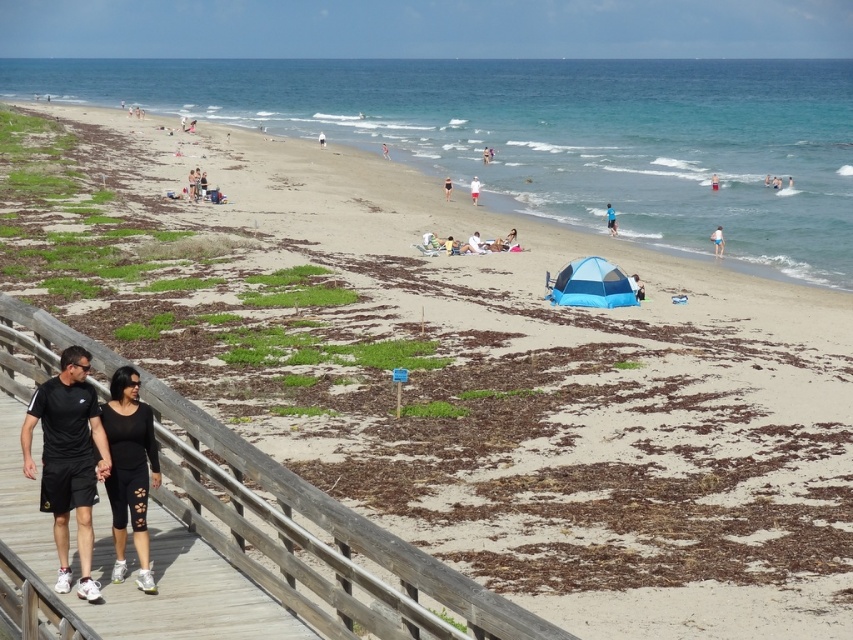
You are a photographer trying to capture a photo of both the black athletic wear at lower left and the black swimsuit at center. Which object should you focus on first if you want to ensure both are in the frame without moving the camera?

You should focus on the black athletic wear at lower left first because it might be wider than the black swimsuit at center, so centering it first ensures both fit within the frame.

You are standing at the camera position and want to walk directly to the white fabric umbrella at center. How far will you have to walk?

The white fabric umbrella at center is 65.24 meters from the camera, so you will have to walk 65.24 meters to reach it.